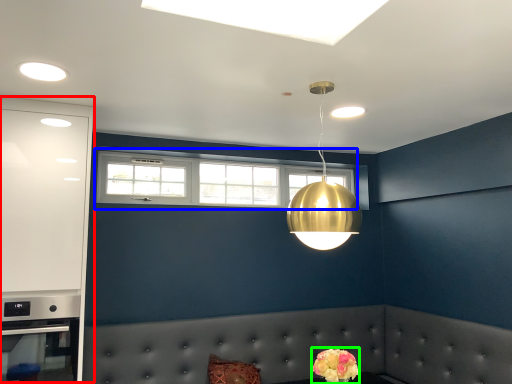
Question: Which object is the closest to the dresser (highlighted by a red box)? Choose among these: window (highlighted by a blue box) or flower (highlighted by a green box).

Choices:
 (A) window
 (B) flower

Answer: (A)